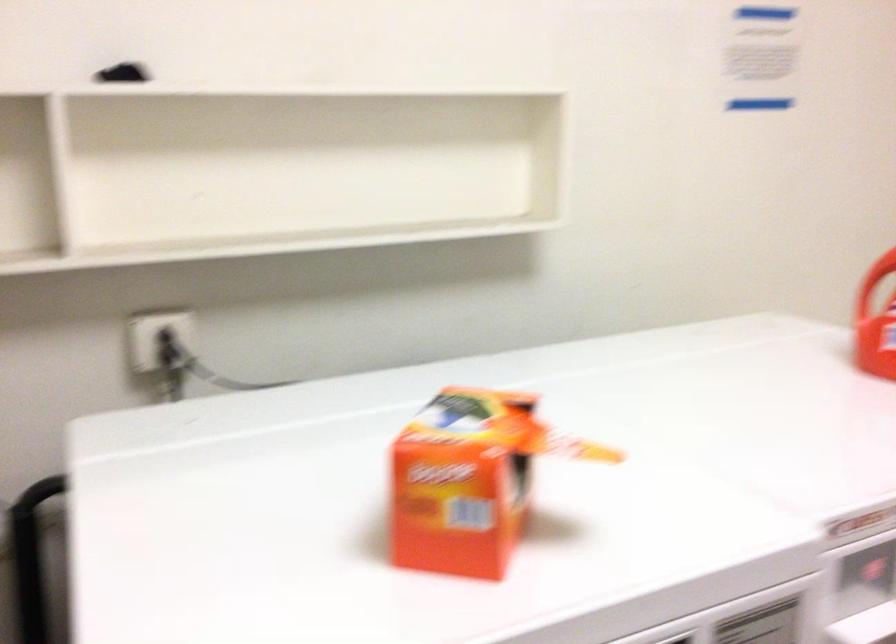
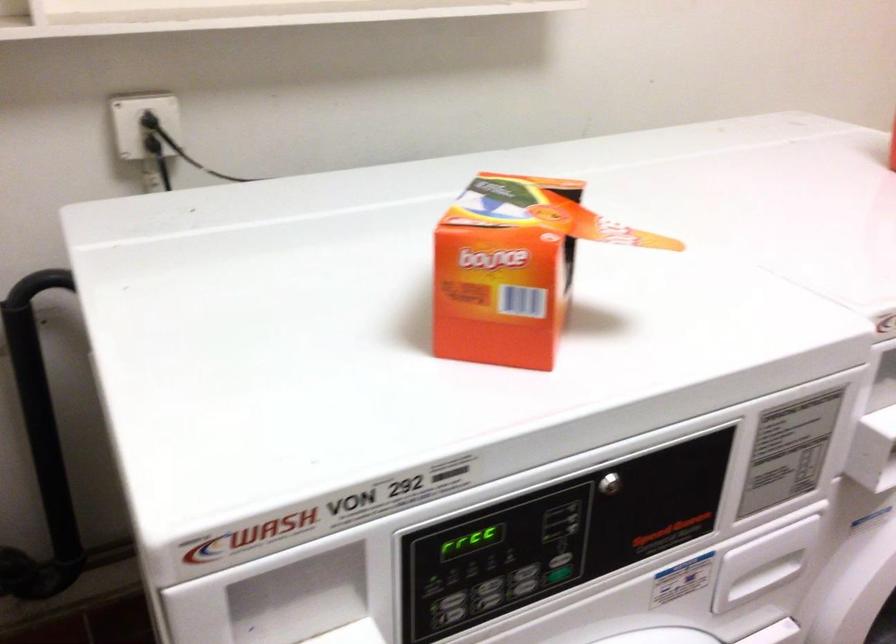
In the second image, find the point that corresponds to (451,503) in the first image.

(502, 287)